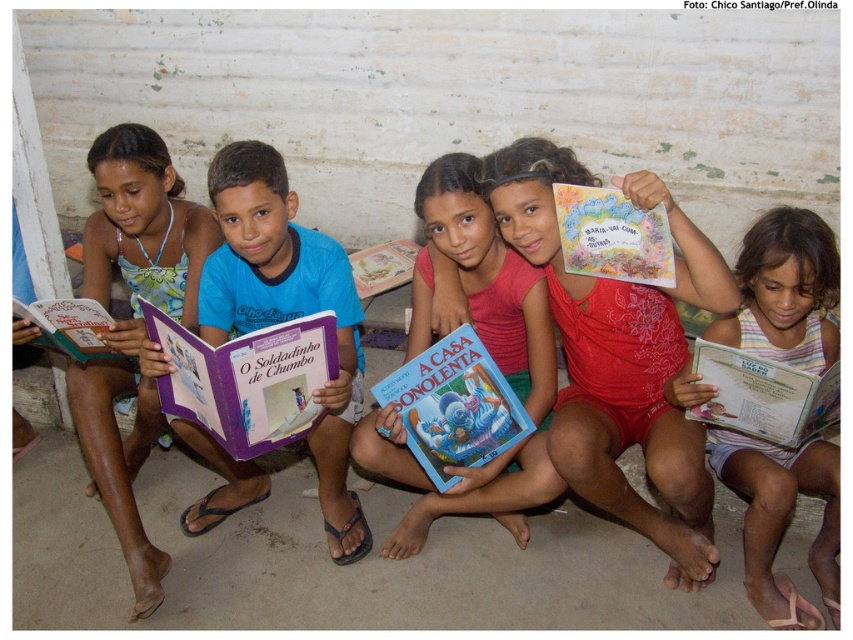
What object is located at the coordinates point (763, 396)?

The point (763, 396) corresponds to the white paper book at center.